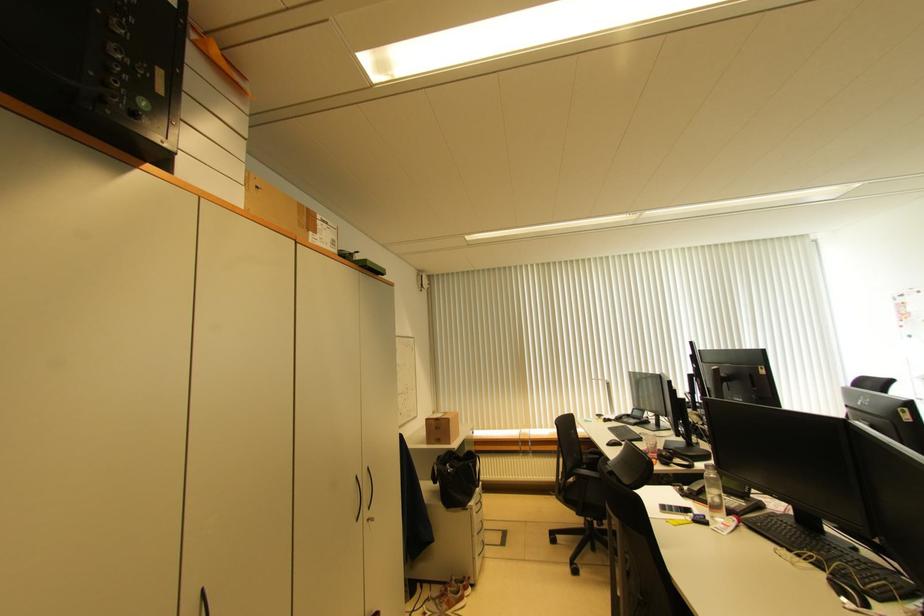
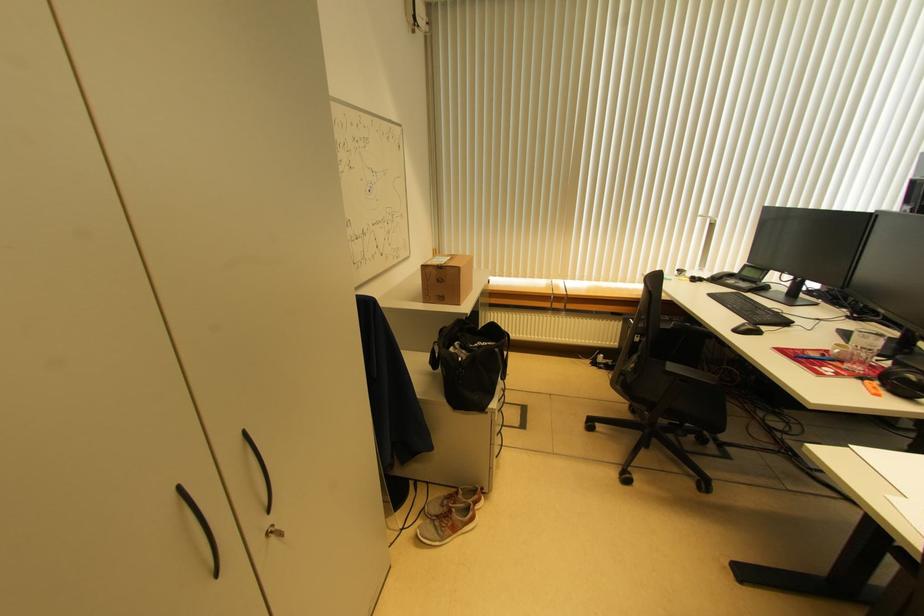
Where in the second image is the point corresponding to point (612, 448) from the first image?

(738, 334)